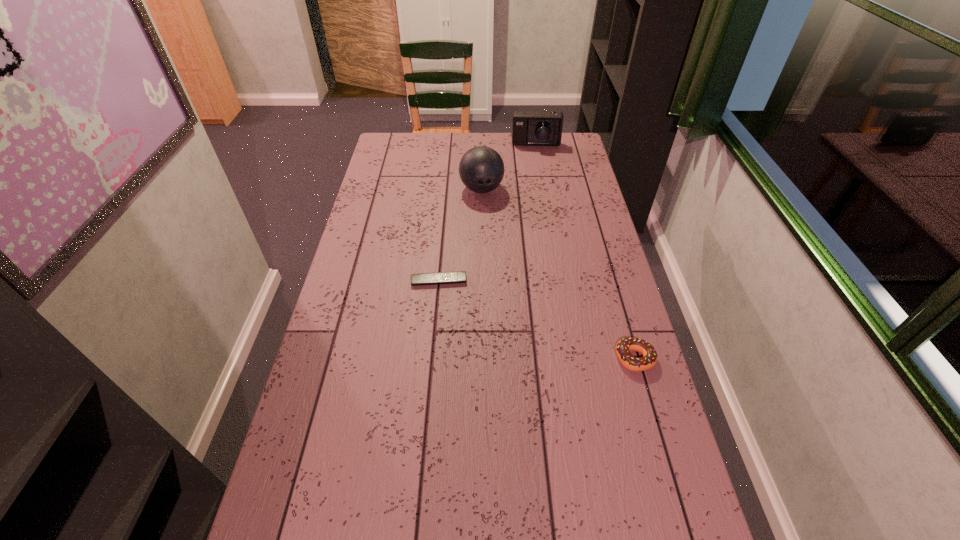
This screenshot has width=960, height=540. Find the location of `free space between the third farthest object and the camera`. free space between the third farthest object and the camera is located at coordinates (488, 213).

You are a GUI agent. You are given a task and a screenshot of the screen. Output one action in this format:
    pyautogui.click(x=<x>, y=<y>)
    Task: Click on the free space between the third shortest object and the second shortest object
    The width and height of the screenshot is (960, 540).
    Given the screenshot: What is the action you would take?
    pyautogui.click(x=586, y=252)

I want to click on blank region between the third tallest object and the remote control, so click(537, 319).

Locate an element on the screen. empty space that is in between the shortest object and the third object from left to right is located at coordinates coord(488,213).

You are a GUI agent. You are given a task and a screenshot of the screen. Output one action in this format:
    pyautogui.click(x=<x>, y=<y>)
    Task: Click on the free space that is in between the third farthest object and the rightmost object
    The width and height of the screenshot is (960, 540).
    Given the screenshot: What is the action you would take?
    pyautogui.click(x=537, y=319)

The height and width of the screenshot is (540, 960). I want to click on vacant area that lies between the shortest object and the second shortest object, so click(x=537, y=319).

Select which object appears as the third closest to the remote control. Please provide its 2D coordinates. Your answer should be formatted as a tuple, i.e. [(x, y)], where the tuple contains the x and y coordinates of a point satisfying the conditions above.

[(530, 128)]

Locate an element on the screen. This screenshot has height=540, width=960. the second closest object to the second tallest object is located at coordinates (460, 276).

The image size is (960, 540). I want to click on vacant space that satisfies the following two spatial constraints: 1. on the front side of the rightmost object; 2. on the right side of the remote control, so click(x=432, y=358).